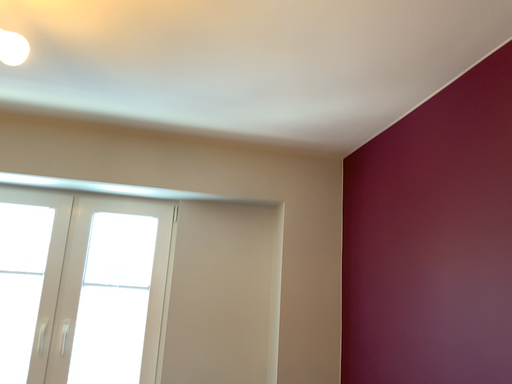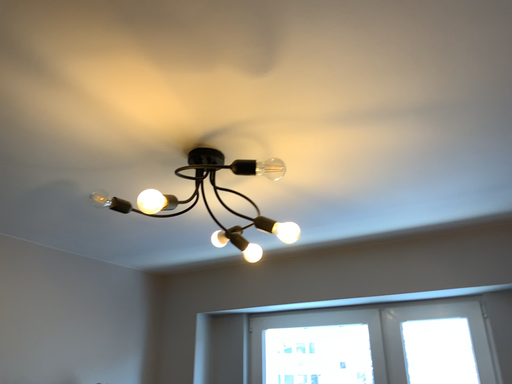
Question: How did the camera likely rotate when shooting the video?

Choices:
 (A) rotated right
 (B) rotated left

Answer: (B)